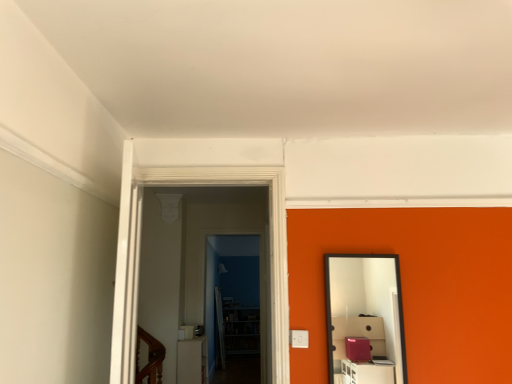
Question: Is transparent glass door at center, positioned as the 1th glass door in front-to-back order, in front of black framed mirror at right?

Choices:
 (A) no
 (B) yes

Answer: (B)

Question: From a real-world perspective, does transparent glass door at center, positioned as the 1th glass door in front-to-back order, stand above black framed mirror at right?

Choices:
 (A) yes
 (B) no

Answer: (A)

Question: Is transparent glass door at center, the 2th glass door when ordered from back to front, facing away from black framed mirror at right?

Choices:
 (A) no
 (B) yes

Answer: (A)

Question: Would you say transparent glass door at center, positioned as the 1th glass door in front-to-back order, contains black framed mirror at right?

Choices:
 (A) yes
 (B) no

Answer: (B)

Question: From the image's perspective, is transparent glass door at center, the 2th glass door when ordered from back to front, located above black framed mirror at right?

Choices:
 (A) no
 (B) yes

Answer: (B)

Question: Is white glossy light switch at center bigger or smaller than transparent glass door at center, the 2th glass door when ordered from back to front?

Choices:
 (A) small
 (B) big

Answer: (A)

Question: Considering the positions of white glossy light switch at center and transparent glass door at center, positioned as the 1th glass door in front-to-back order, in the image, is white glossy light switch at center wider or thinner than transparent glass door at center, positioned as the 1th glass door in front-to-back order,?

Choices:
 (A) thin
 (B) wide

Answer: (B)

Question: From a real-world perspective, is white glossy light switch at center physically located above or below transparent glass door at center, the 2th glass door when ordered from back to front?

Choices:
 (A) above
 (B) below

Answer: (B)

Question: Would you say white glossy light switch at center is to the left or to the right of transparent glass door at center, positioned as the 1th glass door in front-to-back order, in the picture?

Choices:
 (A) right
 (B) left

Answer: (B)

Question: Considering the positions of point [x=208, y=344] and point [x=189, y=379], is point [x=208, y=344] closer or farther from the camera than point [x=189, y=379]?

Choices:
 (A) farther
 (B) closer

Answer: (A)

Question: From the image's perspective, is transparent glass door at center, arranged as the first glass door when viewed from the back, positioned above or below white glossy light switch at center?

Choices:
 (A) above
 (B) below

Answer: (A)

Question: Visually, is transparent glass door at center, arranged as the first glass door when viewed from the back, positioned to the left or to the right of white glossy light switch at center?

Choices:
 (A) right
 (B) left

Answer: (A)

Question: Is transparent glass door at center, acting as the second glass door starting from the front, inside the boundaries of white glossy light switch at center, or outside?

Choices:
 (A) outside
 (B) inside

Answer: (A)

Question: Is black framed mirror at right to the left or to the right of white glossy light switch at center in the image?

Choices:
 (A) right
 (B) left

Answer: (A)

Question: Considering the positions of black framed mirror at right and white glossy light switch at center in the image, is black framed mirror at right wider or thinner than white glossy light switch at center?

Choices:
 (A) wide
 (B) thin

Answer: (B)